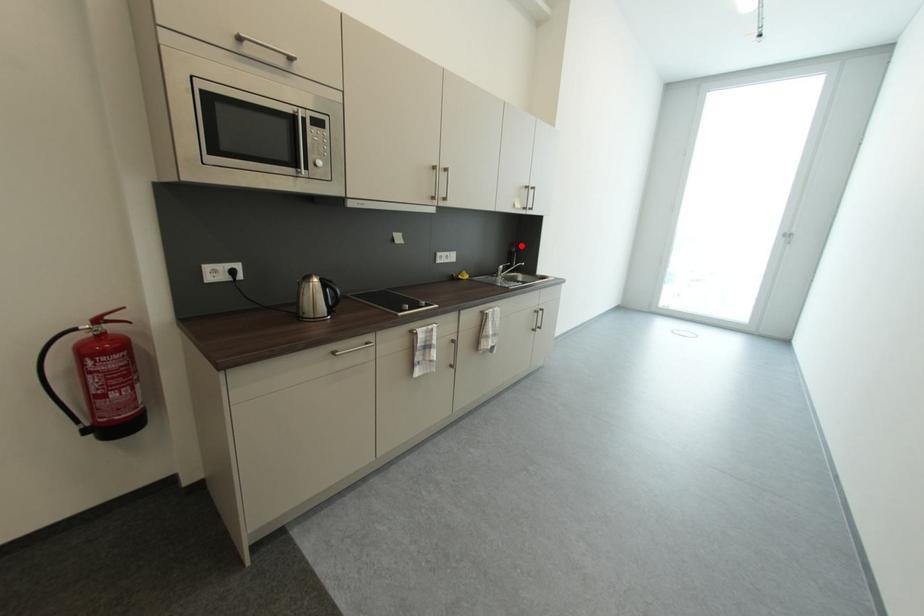
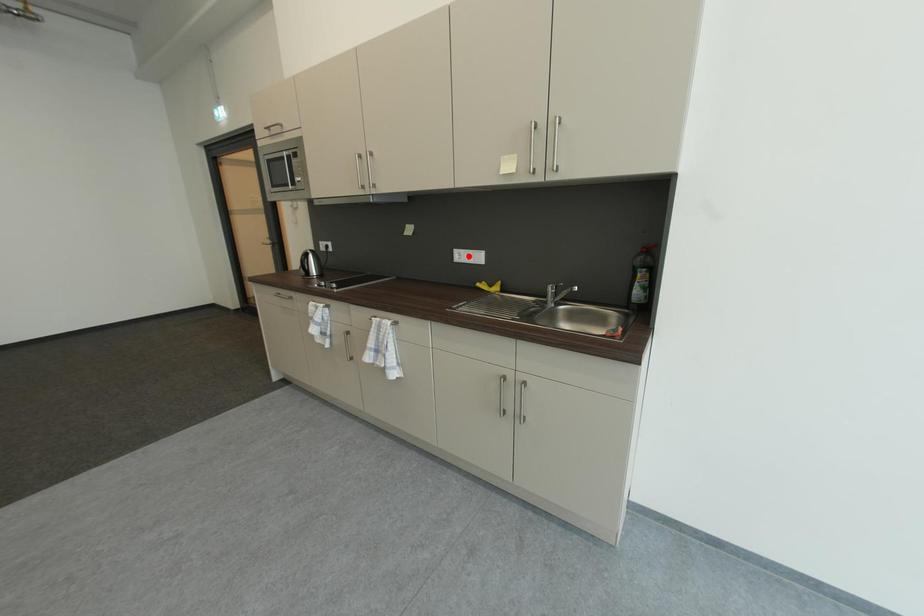
Consider the image. I am providing you with two images of the same scene from different viewpoints. A red point is marked on the first image and another point is marked on the second image. Is the red point in image1 aligned with the point shown in image2?

No